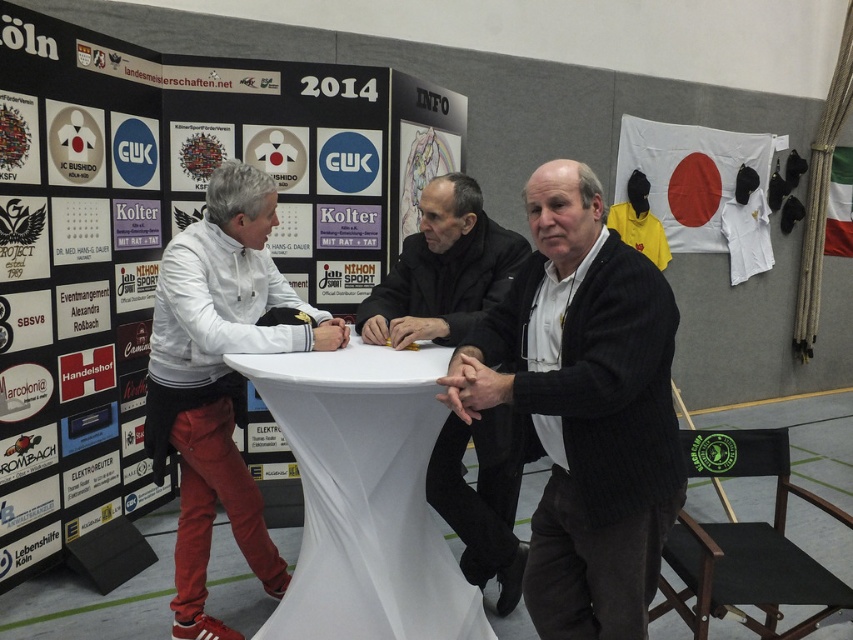
Is white cloth-covered table at center bigger than white matte jacket at left?

Incorrect, white cloth-covered table at center is not larger than white matte jacket at left.

Which of these two, white cloth-covered table at center or white matte jacket at left, stands shorter?

With less height is white cloth-covered table at center.

Locate an element on the screen. The image size is (853, 640). white cloth-covered table at center is located at coordinates (364, 497).

Is point (173, 344) behind point (463, 332)?

Yes, point (173, 344) is behind point (463, 332).

Between point (195, 404) and point (451, 336), which one is positioned behind?

Positioned behind is point (195, 404).

Where is `white matte jacket at left`? white matte jacket at left is located at coordinates (219, 378).

Which is behind, point (589, 632) or point (271, 225)?

Positioned behind is point (271, 225).

Is point (606, 552) in front of point (228, 634)?

Yes, point (606, 552) is in front of point (228, 634).

Who is more forward, (643, 380) or (196, 371)?

Point (643, 380)

Where is `black woolen sweater at center`? This screenshot has height=640, width=853. black woolen sweater at center is located at coordinates (584, 406).